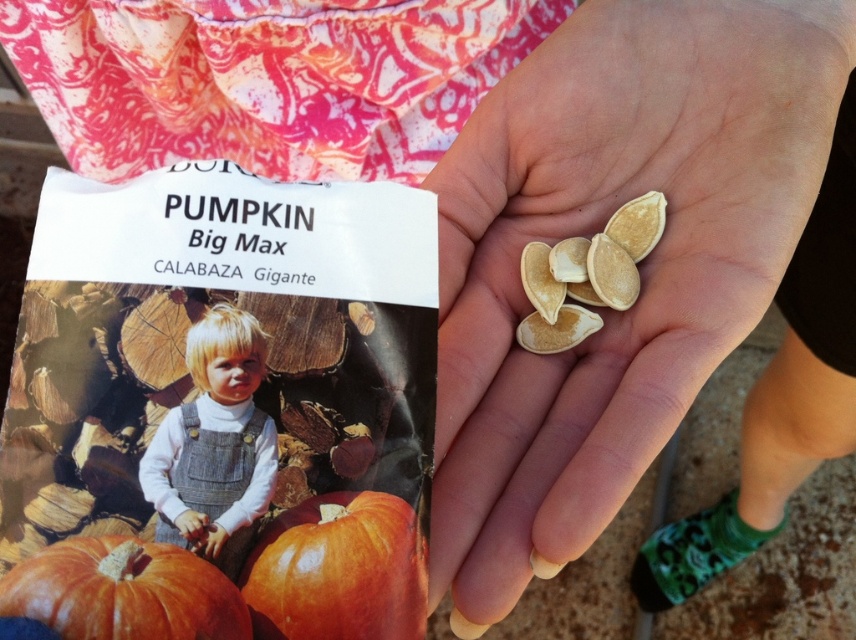
What is the spatial relationship between the orange matte pumpkin at lower left and the seed packet labeled

The orange matte pumpkin at lower left is located at point (123, 592) in the image, which is to the lower left of the seed packet labeled

Based on the scene description, where is the light brown denim overalls at center located in terms of its 2D coordinates?

The light brown denim overalls at center is located at the 2D coordinates of point (214, 444).